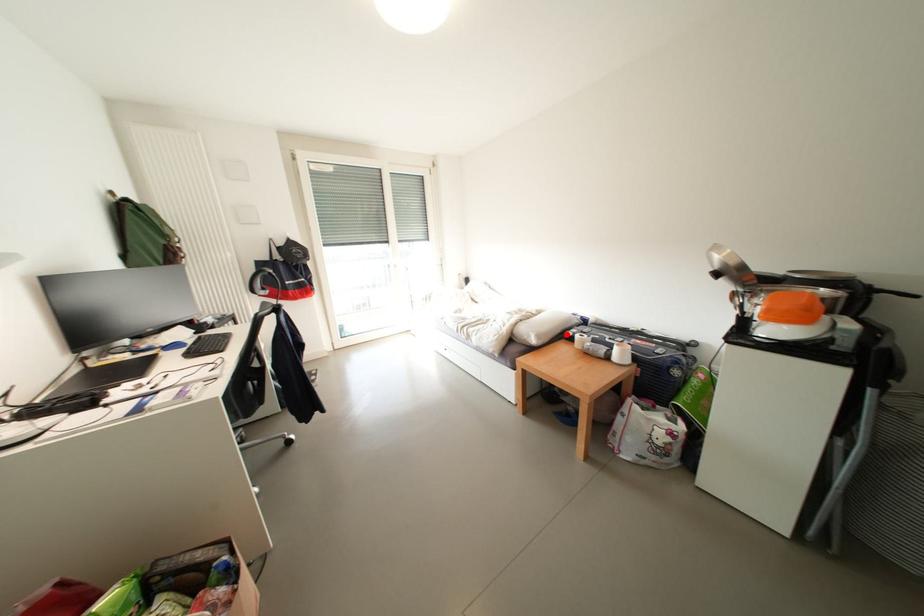
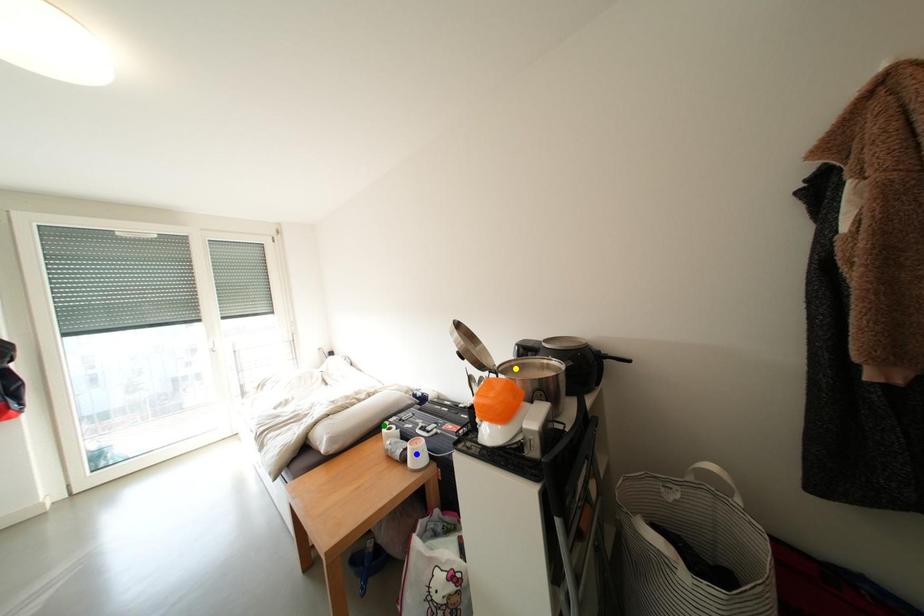
Question: I am providing you with two images of the same scene from different viewpoints. A red point is marked on the first image. You are given multiple points on the second image. Which point in image 2 represents the same 3d spot as the red point in image 1?

Choices:
 (A) blue point
 (B) green point
 (C) yellow point

Answer: (B)